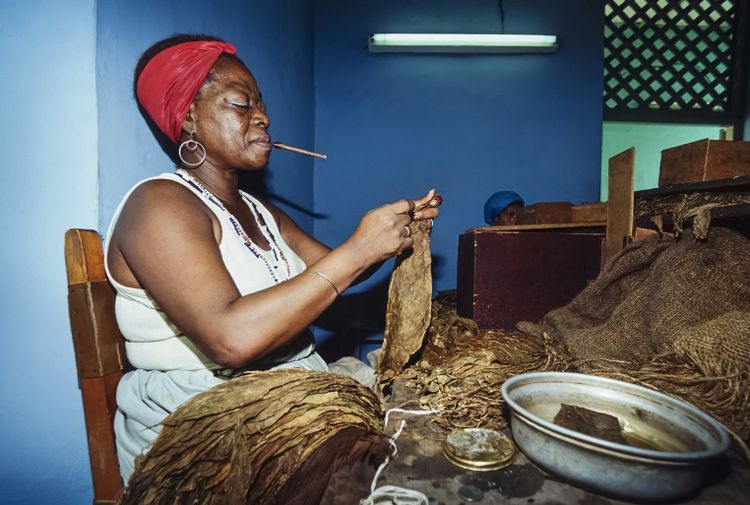
Find the location of a particular element. blue wall below light is located at coordinates (484, 130).